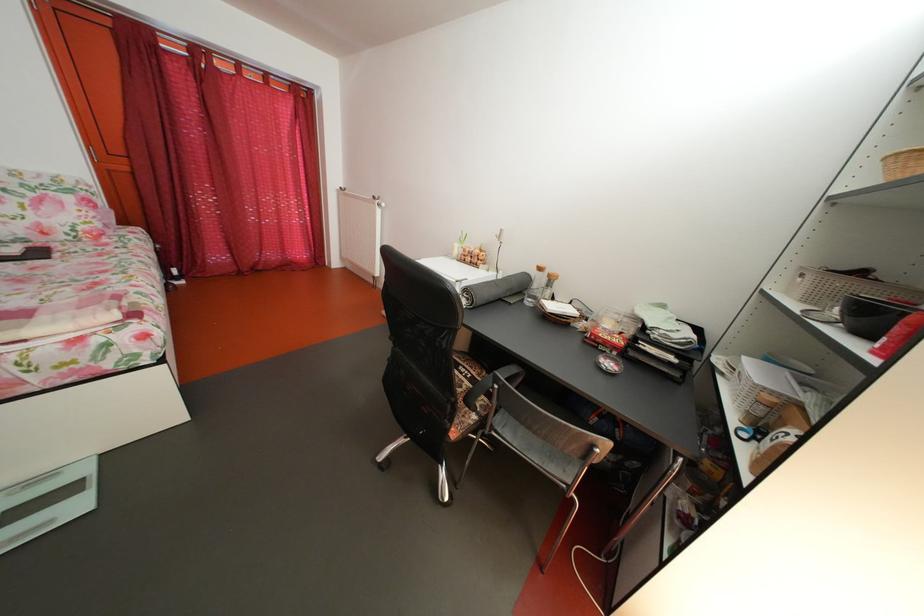
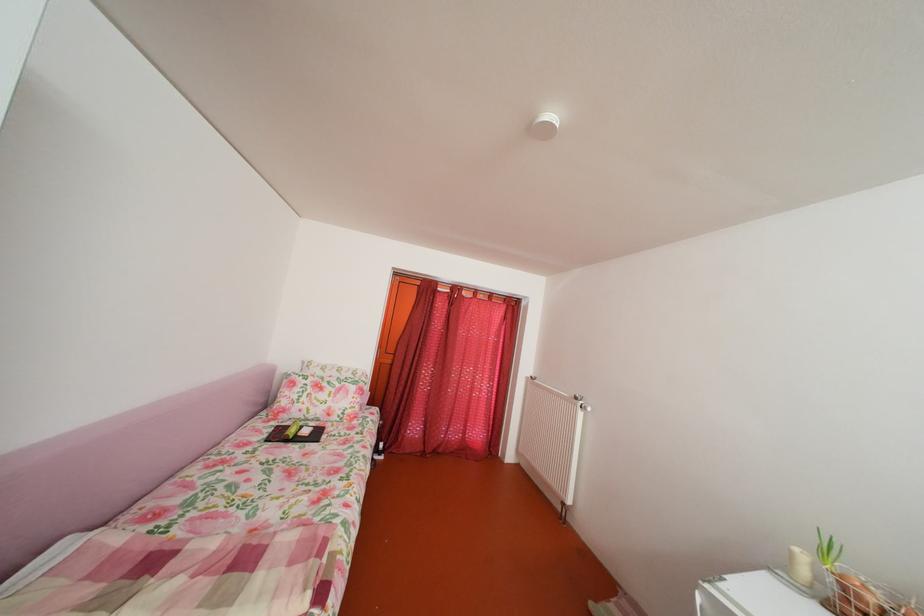
Where in the second image is the point corresponding to [304,140] from the first image?

(511, 337)